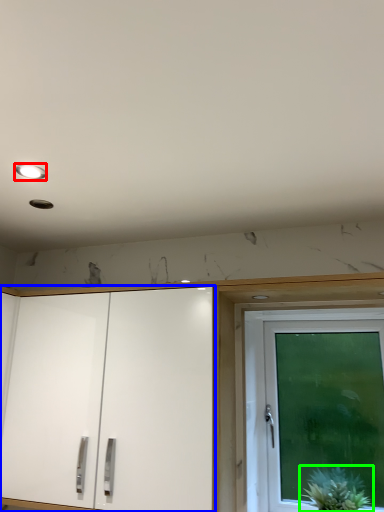
Question: Based on their relative distances, which object is nearer to lighting (highlighted by a red box)? Choose from cabinetry (highlighted by a blue box) and houseplant (highlighted by a green box).

Choices:
 (A) cabinetry
 (B) houseplant

Answer: (A)